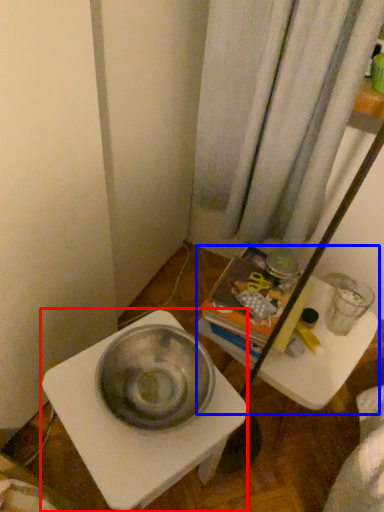
Question: Which object appears closest to the camera in this image, table (highlighted by a red box) or vanity (highlighted by a blue box)?

Choices:
 (A) table
 (B) vanity

Answer: (A)